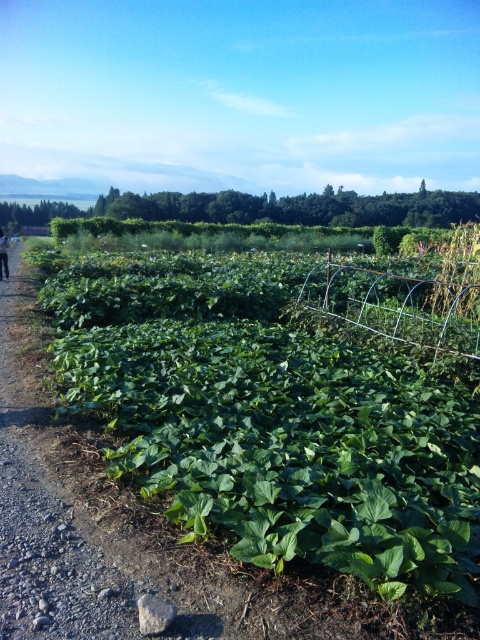
Is green leafy plant at center bigger than black fabric at left?

No.

Between point (359, 552) and point (4, 253), which one is positioned behind?

Point (4, 253)

Where is `green leafy plant at center`? green leafy plant at center is located at coordinates (280, 435).